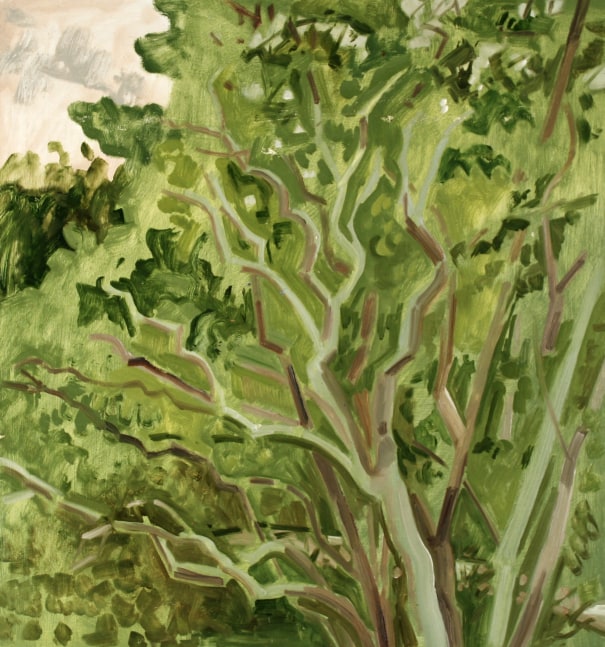
You are a GUI agent. You are given a task and a screenshot of the screen. Output one action in this format:
    pyautogui.click(x=<x>, y=<y>)
    Task: Click on the light green paint
    
    Given the screenshot: What is the action you would take?
    pyautogui.click(x=263, y=393), pyautogui.click(x=593, y=223), pyautogui.click(x=431, y=135), pyautogui.click(x=194, y=87), pyautogui.click(x=42, y=534), pyautogui.click(x=596, y=565)